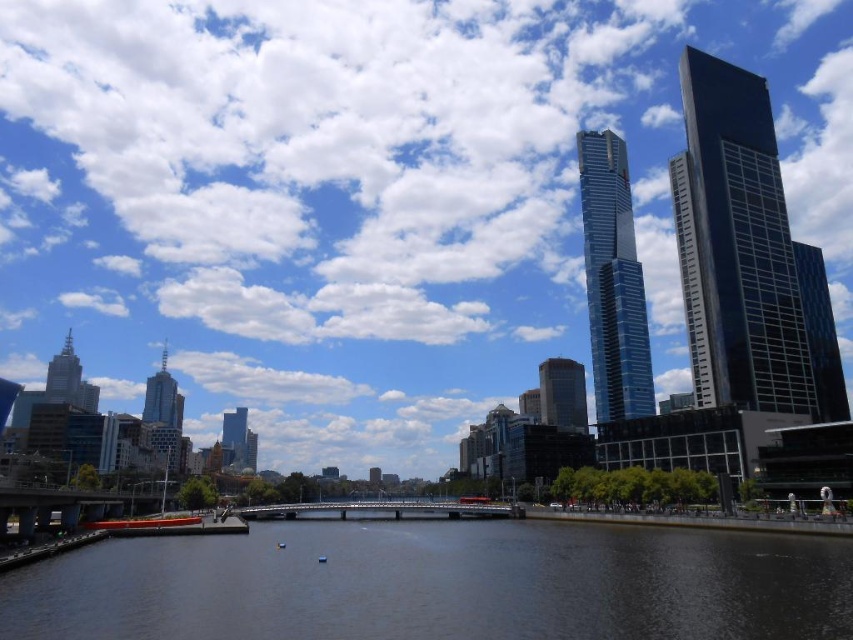
Question: Can you confirm if dark blue water at center is thinner than glassy blue skyscraper at center right?

Choices:
 (A) yes
 (B) no

Answer: (B)

Question: Does glassy blue skyscraper at center right appear under glassy reflective skyscraper at center?

Choices:
 (A) yes
 (B) no

Answer: (B)

Question: Which object is positioned farthest from the dark blue water at center?

Choices:
 (A) glassy blue skyscraper at center
 (B) glassy reflective skyscraper at center
 (C) shiny metallic skyscraper at left

Answer: (A)

Question: Among these points, which one is nearest to the camera?

Choices:
 (A) (618, 272)
 (B) (701, 244)
 (C) (177, 563)

Answer: (C)

Question: Estimate the real-world distances between objects in this image. Which object is closer to the shiny metallic skyscraper at left?

Choices:
 (A) glassy blue skyscraper at center
 (B) dark blue water at center
 (C) glassy reflective skyscraper at center
 (D) shiny glass skyscraper at upper right

Answer: (A)

Question: Is glassy blue skyscraper at center right behind shiny silver spire at left?

Choices:
 (A) yes
 (B) no

Answer: (B)